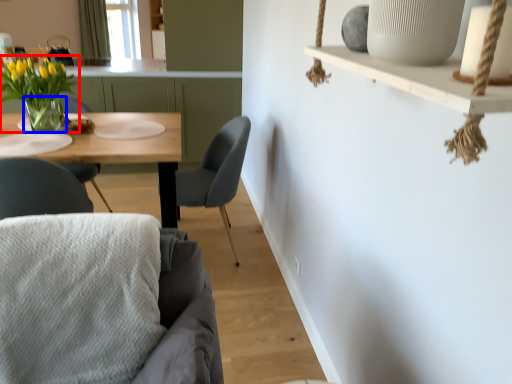
Question: Which object appears closest to the camera in this image, houseplant (highlighted by a red box) or vase (highlighted by a blue box)?

Choices:
 (A) houseplant
 (B) vase

Answer: (A)